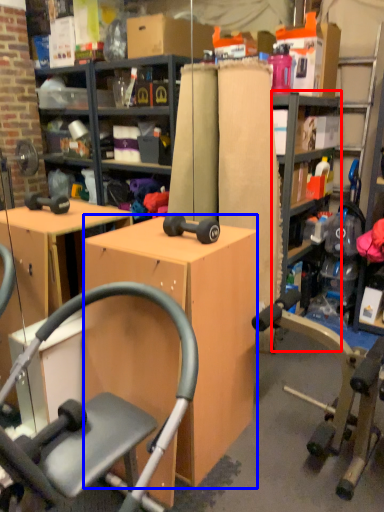
Question: Which object appears farthest to the camera in this image, bookshelf (highlighted by a red box) or desk (highlighted by a blue box)?

Choices:
 (A) bookshelf
 (B) desk

Answer: (A)